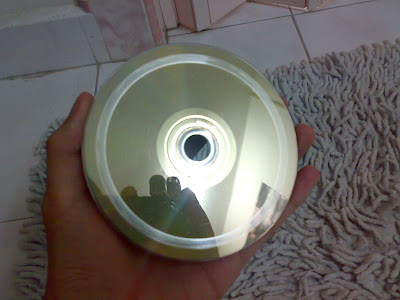
Locate an element on the screen. reflection of wall in cd is located at coordinates (268, 146).